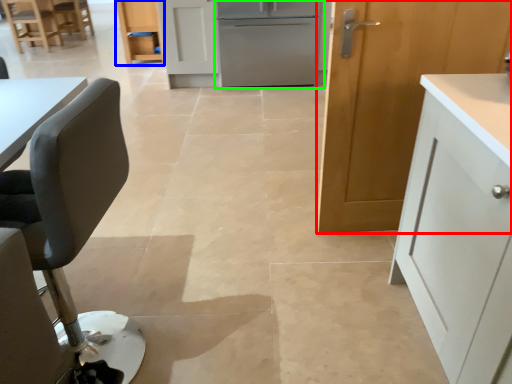
Question: Which object is positioned closest to cabinetry (highlighted by a red box)? Select from cabinetry (highlighted by a blue box) and refrigerator (highlighted by a green box).

Choices:
 (A) cabinetry
 (B) refrigerator

Answer: (B)